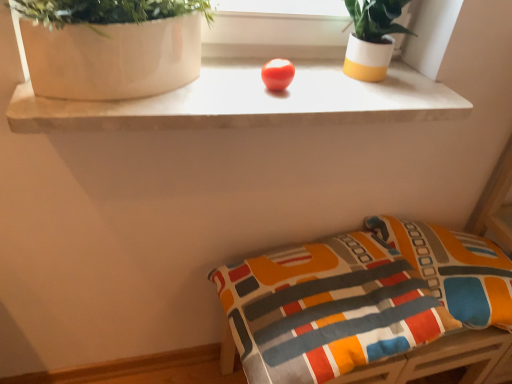
The image size is (512, 384). In order to click on blank space to the left of white/yellow ceramic pot at upper right in this screenshot , I will do `click(297, 69)`.